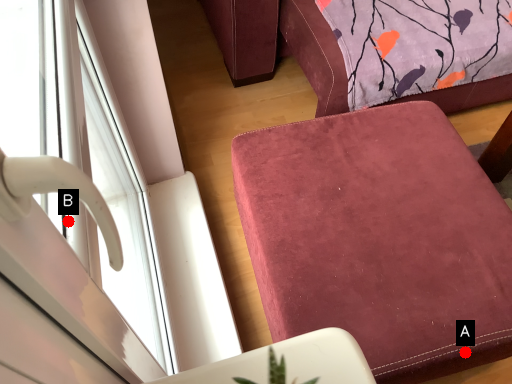
Question: Two points are circled on the image, labeled by A and B beside each circle. Which point appears farthest from the camera in this image?

Choices:
 (A) A is further
 (B) B is further

Answer: (A)